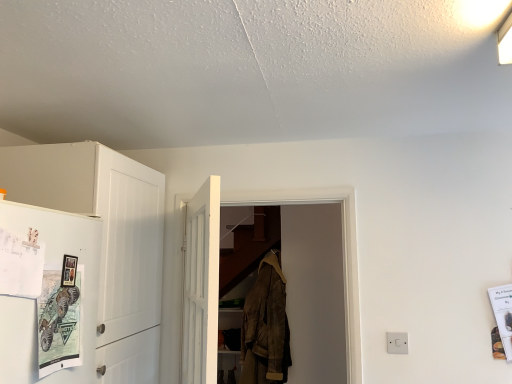
Question: Is white glossy refrigerator at left in front of or behind metallic poster at lower left in the image?

Choices:
 (A) behind
 (B) front

Answer: (B)

Question: In terms of width, does white glossy refrigerator at left look wider or thinner when compared to metallic poster at lower left?

Choices:
 (A) thin
 (B) wide

Answer: (A)

Question: Which object is positioned farthest from the white wooden door at center, the second door positioned from the back?

Choices:
 (A) white matte cabinet at left
 (B) white glossy refrigerator at left
 (C) white wooden door at center, positioned as the second door in front-to-back order
 (D) white plastic switch at lower right
 (E) metallic poster at lower left

Answer: (D)

Question: Which of these objects is positioned farthest from the white plastic switch at lower right?

Choices:
 (A) white matte cabinet at left
 (B) metallic poster at lower left
 (C) brown suede jacket at center
 (D) white wooden door at center, the first door positioned from the back
 (E) white glossy refrigerator at left

Answer: (E)